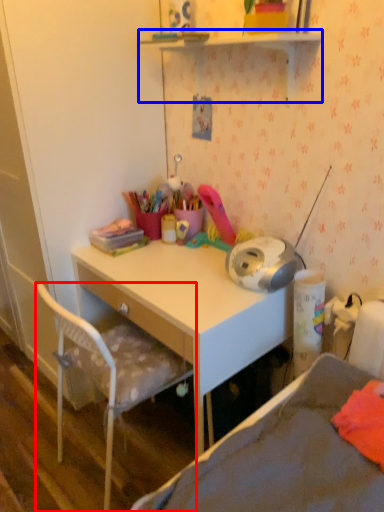
Question: Among these objects, which one is farthest to the camera, chair (highlighted by a red box) or shelf (highlighted by a blue box)?

Choices:
 (A) chair
 (B) shelf

Answer: (A)